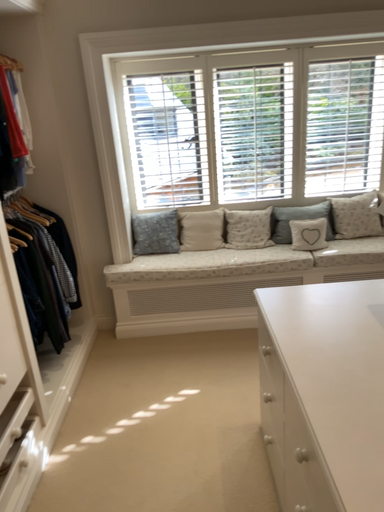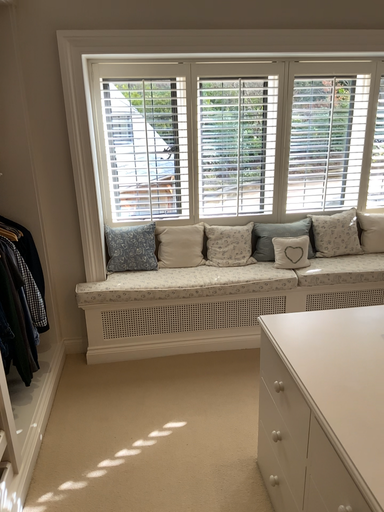
Question: Which way did the camera rotate in the video?

Choices:
 (A) rotated right
 (B) rotated left

Answer: (A)